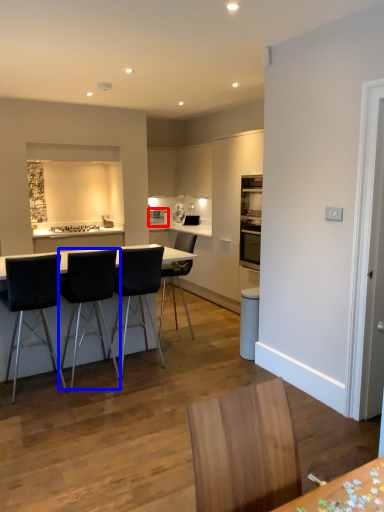
Question: Which point is closer to the camera, appliance (highlighted by a red box) or chair (highlighted by a blue box)?

Choices:
 (A) appliance
 (B) chair

Answer: (B)